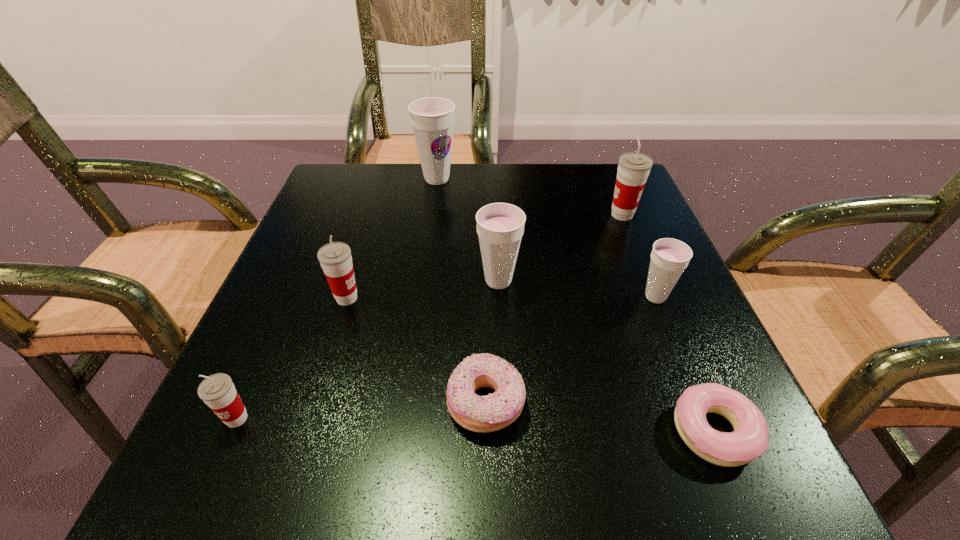
At what (x,y) coordinates should I click in order to perform the action: click on the leftmost object. Please return your answer as a coordinate pair (x, y). Image resolution: width=960 pixels, height=540 pixels. Looking at the image, I should click on (217, 391).

Identify the location of the taller doughnut. (489, 413).

The height and width of the screenshot is (540, 960). I want to click on the left doughnut, so click(489, 413).

Find the location of a particular element. the shorter doughnut is located at coordinates (750, 438).

The width and height of the screenshot is (960, 540). In order to click on the right doughnut in this screenshot , I will do `click(750, 438)`.

Locate an element on the screen. Image resolution: width=960 pixels, height=540 pixels. vacant space situated on the side of the seventh nearest object with the logo is located at coordinates pyautogui.click(x=469, y=215).

You are a GUI agent. You are given a task and a screenshot of the screen. Output one action in this format:
    pyautogui.click(x=<x>, y=<y>)
    Task: Click on the vacant area situated on the side of the seventh nearest object with the logo
    
    Given the screenshot: What is the action you would take?
    pyautogui.click(x=433, y=215)

This screenshot has height=540, width=960. I want to click on vacant space located 0.110m on the side of the seventh nearest object with the logo, so click(x=557, y=215).

I want to click on vacant area situated 0.290m on the right of the farthest purple cup, so click(x=577, y=179).

The height and width of the screenshot is (540, 960). Identify the location of free location located 0.140m on the side of the fifth cup from right to left with the logo. (441, 298).